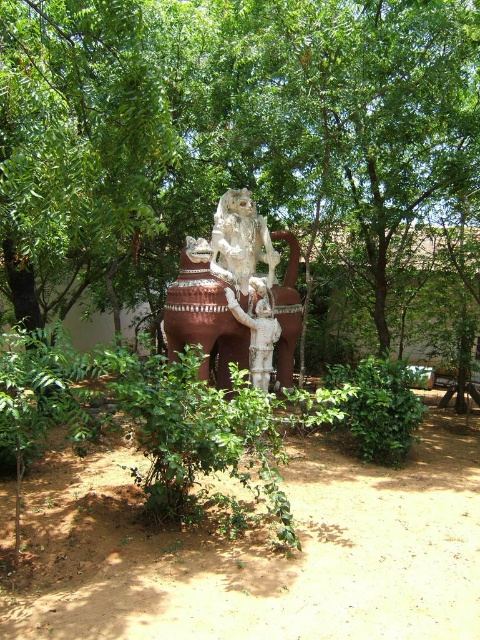
Who is lower down, green leafy tree at center or white glossy statue at center?

white glossy statue at center

Measure the distance from green leafy tree at center to white glossy statue at center.

The distance of green leafy tree at center from white glossy statue at center is 8.20 feet.

Who is more distant from viewer, (72, 129) or (284, 336)?

Point (284, 336)

This screenshot has height=640, width=480. Identify the location of green leafy tree at center. (228, 125).